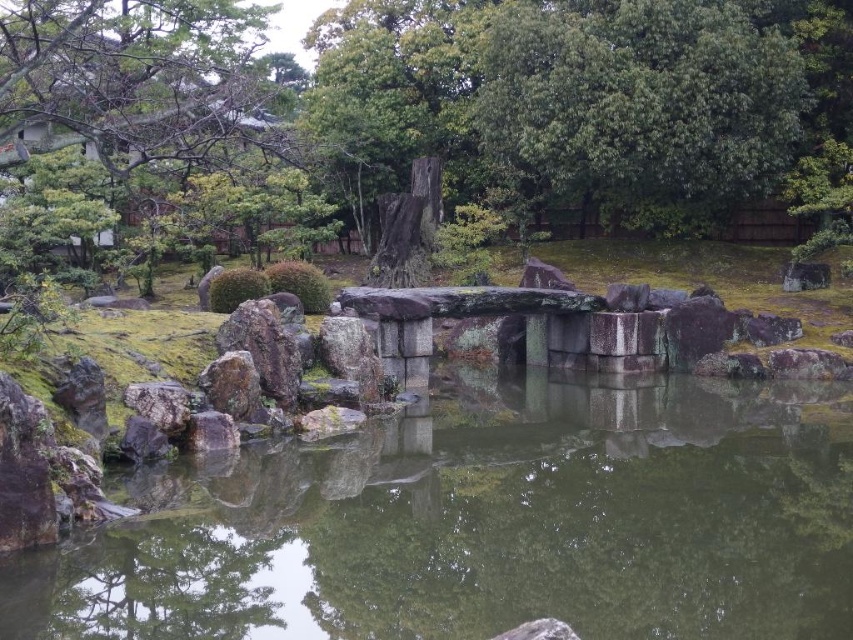
Question: Which object is positioned closest to the smooth gray rock at lower center?

Choices:
 (A) smooth bark tree trunk at center
 (B) green leafy tree at upper left

Answer: (B)

Question: Can you confirm if green mossy water at center is thinner than smooth bark tree trunk at center?

Choices:
 (A) no
 (B) yes

Answer: (B)

Question: Does green mossy water at center have a smaller size compared to smooth gray rock at lower center?

Choices:
 (A) no
 (B) yes

Answer: (A)

Question: Does smooth bark tree trunk at center appear on the right side of green leafy tree at upper left?

Choices:
 (A) no
 (B) yes

Answer: (B)

Question: Which object is the closest to the green mossy water at center?

Choices:
 (A) smooth bark tree trunk at center
 (B) green leafy tree at upper left

Answer: (A)

Question: Among these points, which one is nearest to the camera?

Choices:
 (A) (90, 80)
 (B) (555, 154)

Answer: (B)